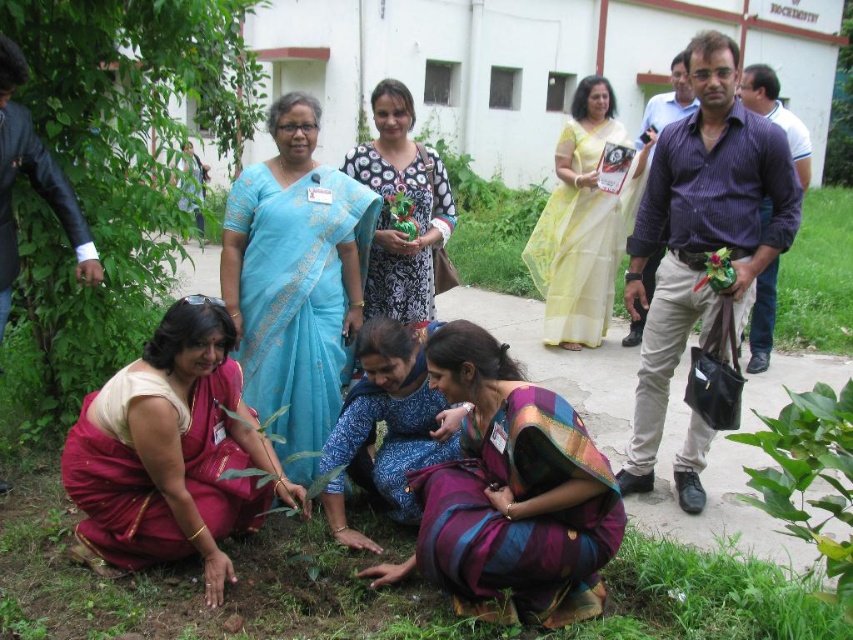
You are a photographer standing at the back of the scene. You want to capture a clear photo of the purple striped shirt at center and the yellow sheer saree at upper center. Which one should you focus on first to ensure both are in focus?

The purple striped shirt at center is in front of the yellow sheer saree at upper center, so you should focus on the purple striped shirt at center first to ensure both are in focus.

Consider the image. What color is the saree located at the coordinates point (x=171, y=452)?

The saree at point (x=171, y=452) is maroon silk saree at lower left.

You are a participant in the tree planting event and you want to place a new sapling exactly at the center of the area where the blue printed fabric at center is located. Can you do that?

The blue printed fabric at center is located at point (386, 428), so you can place the sapling there as it is the specified location.